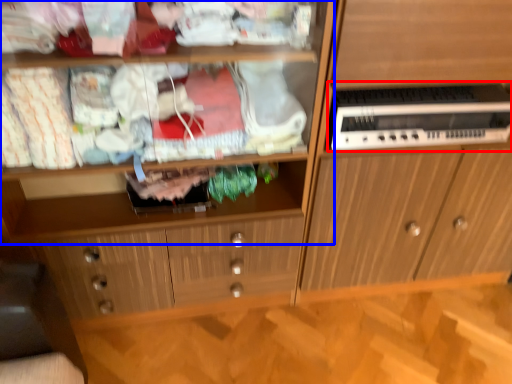
Question: Among these objects, which one is farthest to the camera, home appliance (highlighted by a red box) or shelf (highlighted by a blue box)?

Choices:
 (A) home appliance
 (B) shelf

Answer: (A)